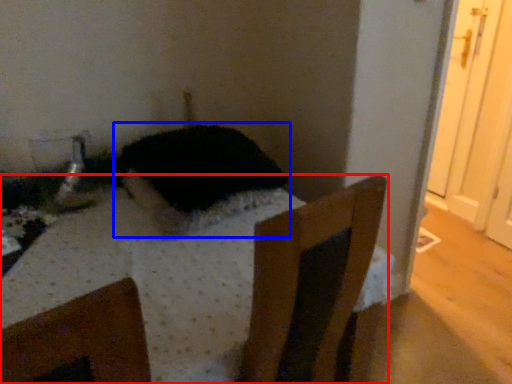
Question: Which object appears farthest to the camera in this image, furniture (highlighted by a red box) or animal (highlighted by a blue box)?

Choices:
 (A) furniture
 (B) animal

Answer: (B)